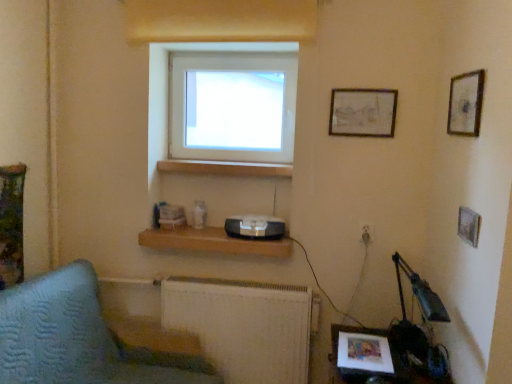
Question: Is matte wooden picture frame at upper right, acting as the first picture frame starting from the back, next to white plastic electric outlet at lower right and touching it?

Choices:
 (A) yes
 (B) no

Answer: (B)

Question: Is matte wooden picture frame at upper right, which ranks as the 2th picture frame in right-to-left order, outside white plastic electric outlet at lower right?

Choices:
 (A) no
 (B) yes

Answer: (B)

Question: Could white plastic electric outlet at lower right be considered to be inside matte wooden picture frame at upper right, which appears as the first picture frame when viewed from the left?

Choices:
 (A) no
 (B) yes

Answer: (A)

Question: Is matte wooden picture frame at upper right, which is the second picture frame in front-to-back order, smaller than white plastic electric outlet at lower right?

Choices:
 (A) yes
 (B) no

Answer: (B)

Question: Does matte wooden picture frame at upper right, which is the second picture frame in front-to-back order, have a greater width compared to white plastic electric outlet at lower right?

Choices:
 (A) no
 (B) yes

Answer: (B)

Question: Considering the positions of point (361, 226) and point (339, 379), is point (361, 226) closer or farther from the camera than point (339, 379)?

Choices:
 (A) closer
 (B) farther

Answer: (B)

Question: Is white plastic electric outlet at lower right spatially inside wooden table at lower right, or outside of it?

Choices:
 (A) outside
 (B) inside

Answer: (A)

Question: Based on their positions, is white plastic electric outlet at lower right located to the left or right of wooden table at lower right?

Choices:
 (A) right
 (B) left

Answer: (A)

Question: Looking at the image, does white plastic electric outlet at lower right seem bigger or smaller compared to wooden table at lower right?

Choices:
 (A) big
 (B) small

Answer: (B)

Question: Considering the positions of point (87, 372) and point (159, 165), is point (87, 372) closer or farther from the camera than point (159, 165)?

Choices:
 (A) closer
 (B) farther

Answer: (A)

Question: From a real-world perspective, is textured fabric sofa at lower left physically located above or below wooden at center?

Choices:
 (A) above
 (B) below

Answer: (B)

Question: Is textured fabric sofa at lower left in front of or behind wooden at center in the image?

Choices:
 (A) front
 (B) behind

Answer: (A)

Question: In terms of height, does textured fabric sofa at lower left look taller or shorter compared to wooden at center?

Choices:
 (A) short
 (B) tall

Answer: (B)

Question: From the image's perspective, is textured fabric sofa at lower left positioned above or below wooden framed picture at upper right, acting as the first picture frame starting from the right?

Choices:
 (A) above
 (B) below

Answer: (B)

Question: Considering the positions of point (97, 367) and point (482, 79), is point (97, 367) closer or farther from the camera than point (482, 79)?

Choices:
 (A) closer
 (B) farther

Answer: (B)